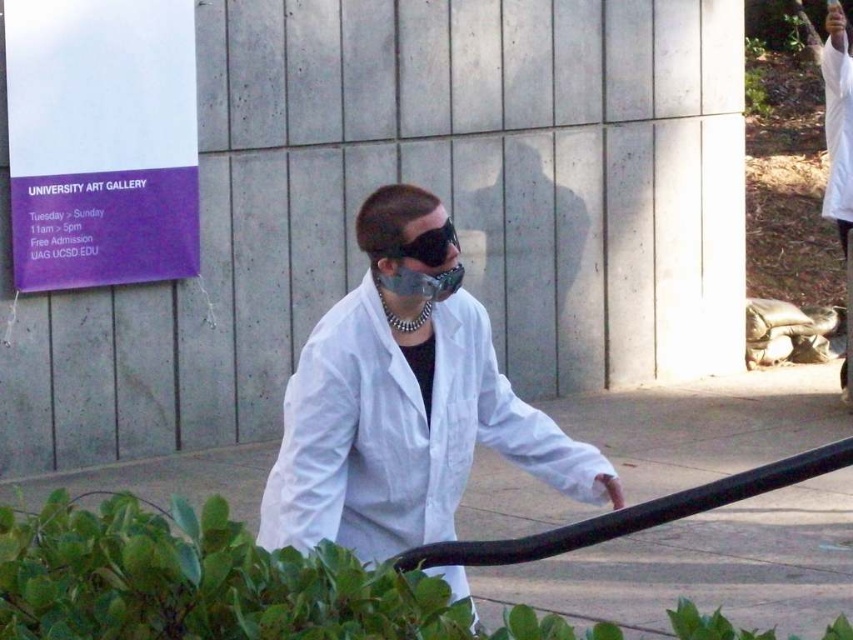
Does white matte lab coat at center have a lesser width compared to black matte sunglasses at center?

No.

Can you confirm if white matte lab coat at center is positioned to the right of black matte sunglasses at center?

Incorrect, white matte lab coat at center is not on the right side of black matte sunglasses at center.

Is point (578, 472) farther from viewer compared to point (407, 243)?

Yes, point (578, 472) is behind point (407, 243).

I want to click on white matte lab coat at center, so point(404,404).